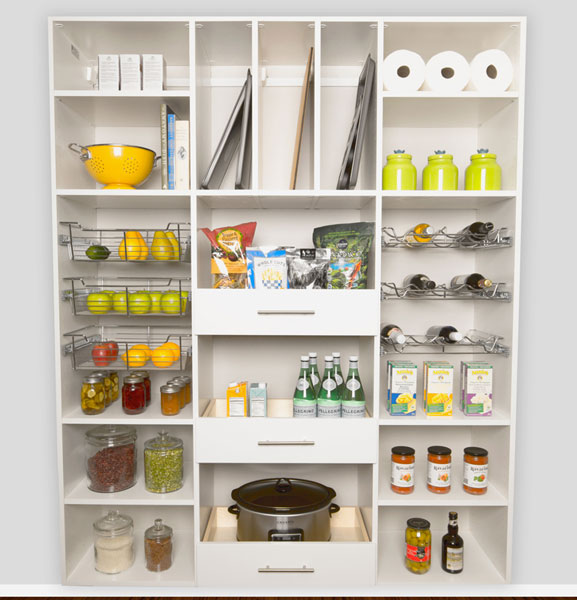
Locate an element on the screen. This screenshot has width=577, height=600. lids on glass containers is located at coordinates (104, 518), (156, 525), (417, 523), (404, 451), (436, 450), (475, 449), (164, 439), (114, 429).